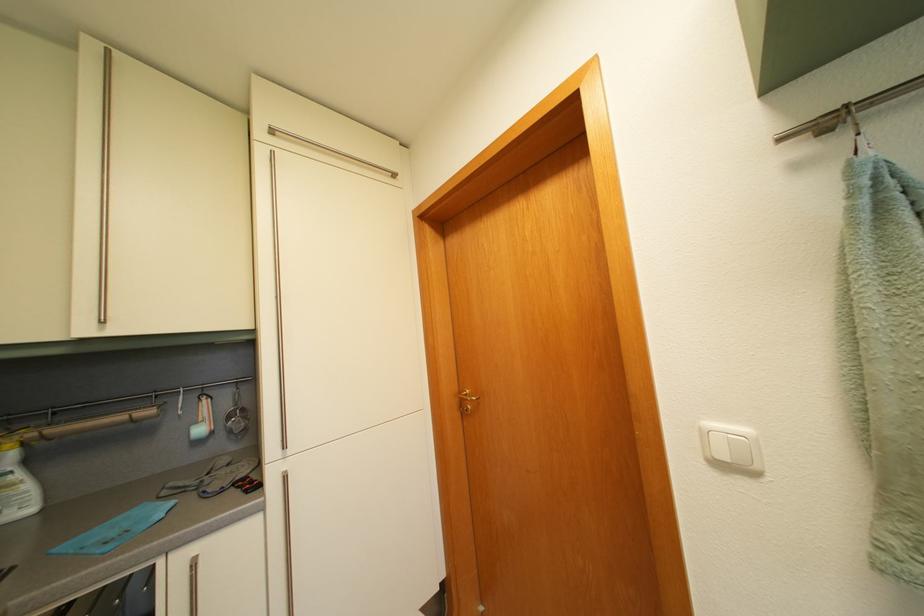
Locate an element on the screen. small measuring cup is located at coordinates (202, 419).